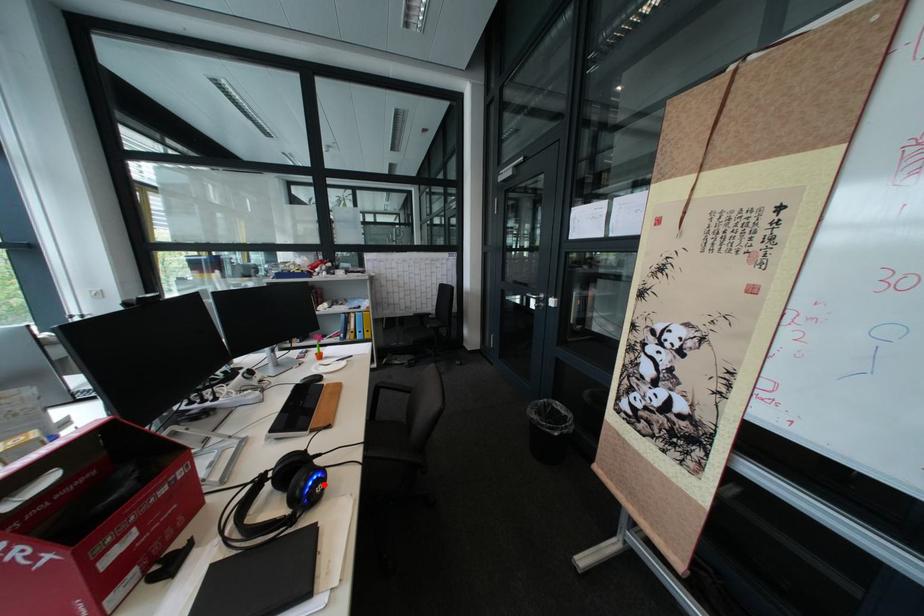
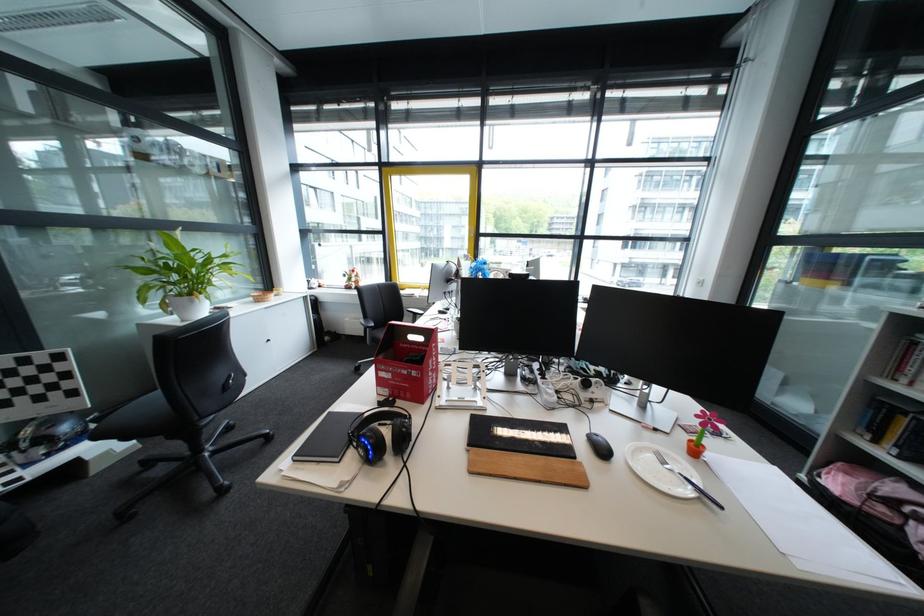
Question: I am providing you with two images of the same scene from different viewpoints. Given a red point in image1, look at the same physical point in image2. Is it:

Choices:
 (A) Closer to the viewpoint
 (B) Farther from the viewpoint

Answer: (B)